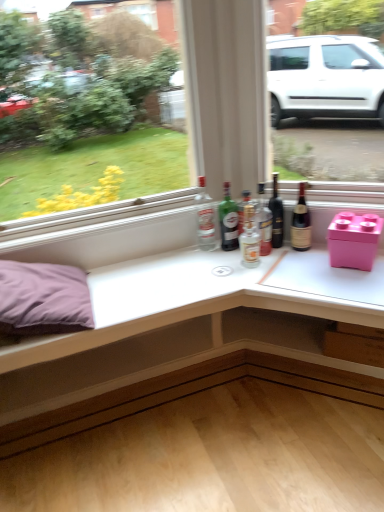
Where is `vacant space in front of translucent glass bottle at center, the third bottle viewed from the left`? This screenshot has width=384, height=512. vacant space in front of translucent glass bottle at center, the third bottle viewed from the left is located at coordinates (256, 261).